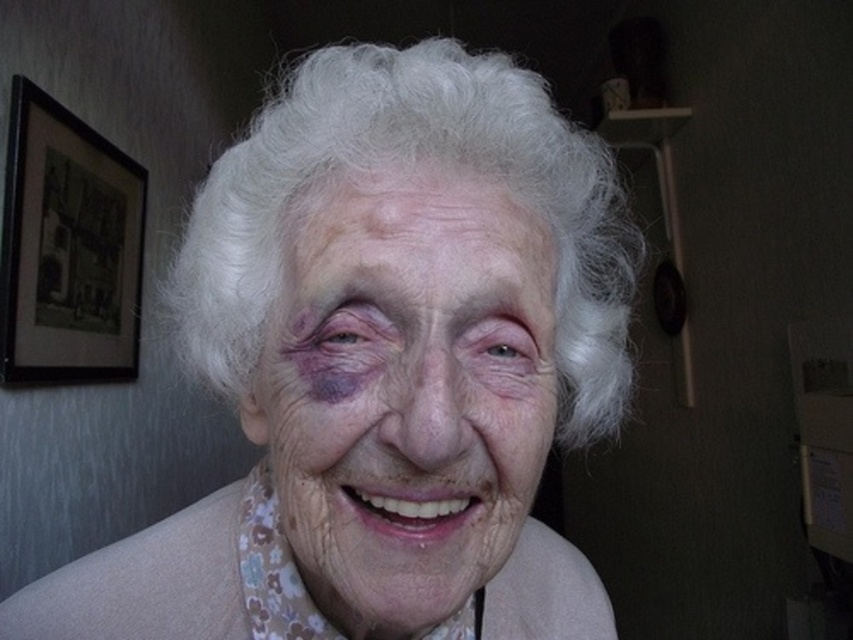
Question: Which object appears closest to the camera in this image?

Choices:
 (A) dry skin at center
 (B) white textured hair at center
 (C) smooth skin face at center

Answer: (C)

Question: Which point is closer to the camera?

Choices:
 (A) smooth skin face at center
 (B) black matte picture frame at upper left
 (C) dry skin at center
 (D) white textured hair at center

Answer: (A)

Question: Does smooth skin face at center have a lesser width compared to black matte picture frame at upper left?

Choices:
 (A) no
 (B) yes

Answer: (A)

Question: Is the position of white textured hair at center more distant than that of black matte picture frame at upper left?

Choices:
 (A) yes
 (B) no

Answer: (B)

Question: Does smooth skin face at center appear on the right side of black matte picture frame at upper left?

Choices:
 (A) yes
 (B) no

Answer: (A)

Question: Which point appears closest to the camera in this image?

Choices:
 (A) (527, 230)
 (B) (415, 179)
 (C) (315, 531)
 (D) (85, 124)

Answer: (B)